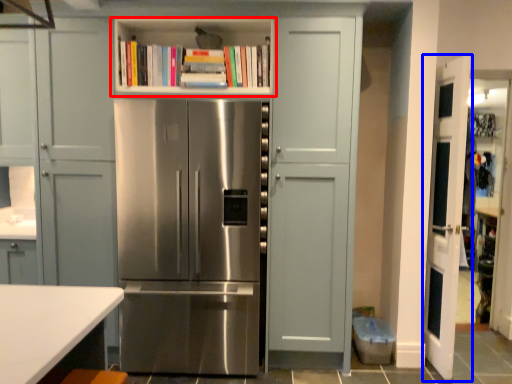
Question: Which object appears farthest to the camera in this image, shelf (highlighted by a red box) or door (highlighted by a blue box)?

Choices:
 (A) shelf
 (B) door

Answer: (A)